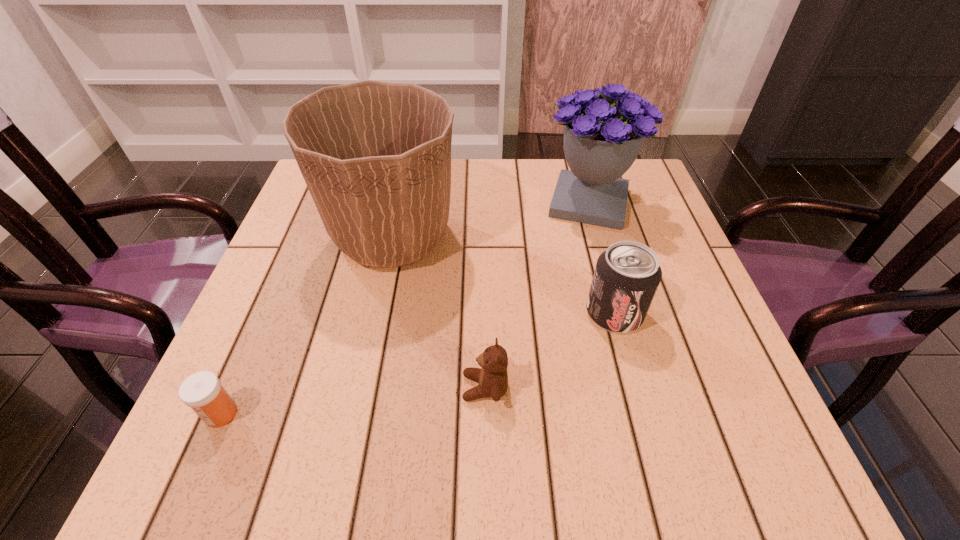
At what (x,y) coordinates should I click in order to perform the action: click on the third closest object to the flowerpot. Please return your answer as a coordinate pair (x, y). This screenshot has width=960, height=540. Looking at the image, I should click on (626, 277).

The height and width of the screenshot is (540, 960). In order to click on free location that satisfies the following two spatial constraints: 1. at the face of the teddy bear; 2. on the front side of the medicine in this screenshot , I will do `click(485, 414)`.

Locate an element on the screen. Image resolution: width=960 pixels, height=540 pixels. vacant space that satisfies the following two spatial constraints: 1. on the back side of the fourth object from right to left; 2. on the left side of the bouquet is located at coordinates (399, 203).